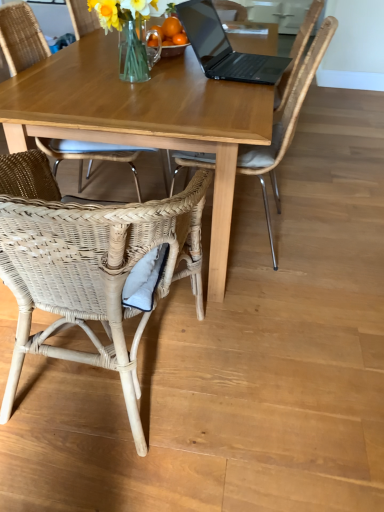
At what (x,y) coordinates should I click in order to perform the action: click on free point behind translucent glass vase at upper center. Please return your answer as a coordinate pair (x, y). Image resolution: width=384 pixels, height=512 pixels. Looking at the image, I should click on (151, 64).